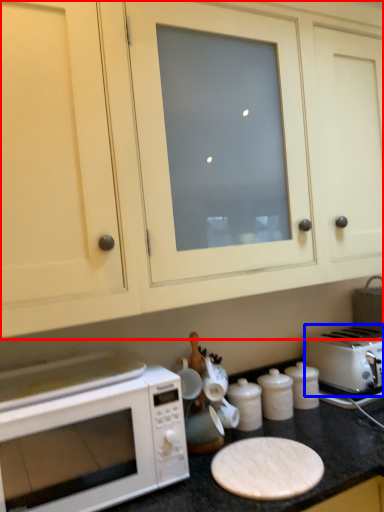
Question: Which of the following is the closest to the observer, cabinetry (highlighted by a red box) or toaster (highlighted by a blue box)?

Choices:
 (A) cabinetry
 (B) toaster

Answer: (A)